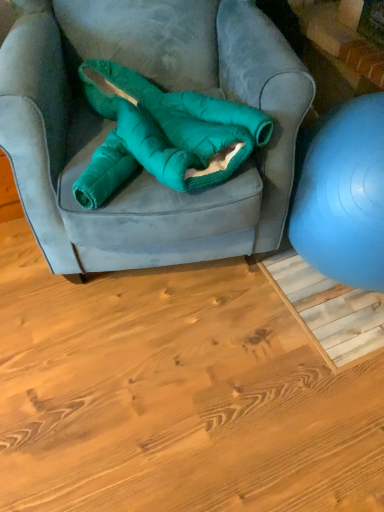
Question: In terms of size, does blue rubber ball at right appear bigger or smaller than teal plush bean bag at center?

Choices:
 (A) small
 (B) big

Answer: (B)

Question: Is blue rubber ball at right in front of or behind teal plush bean bag at center in the image?

Choices:
 (A) behind
 (B) front

Answer: (B)

Question: Would you say blue rubber ball at right is to the left or to the right of teal plush bean bag at center in the picture?

Choices:
 (A) left
 (B) right

Answer: (B)

Question: Looking at the image, does teal plush bean bag at center seem bigger or smaller compared to blue rubber ball at right?

Choices:
 (A) small
 (B) big

Answer: (A)

Question: Considering the positions of teal plush bean bag at center and blue rubber ball at right in the image, is teal plush bean bag at center wider or thinner than blue rubber ball at right?

Choices:
 (A) wide
 (B) thin

Answer: (B)

Question: Considering their positions, is teal plush bean bag at center located in front of or behind blue rubber ball at right?

Choices:
 (A) behind
 (B) front

Answer: (A)

Question: From the image's perspective, is teal plush bean bag at center above or below blue rubber ball at right?

Choices:
 (A) below
 (B) above

Answer: (B)